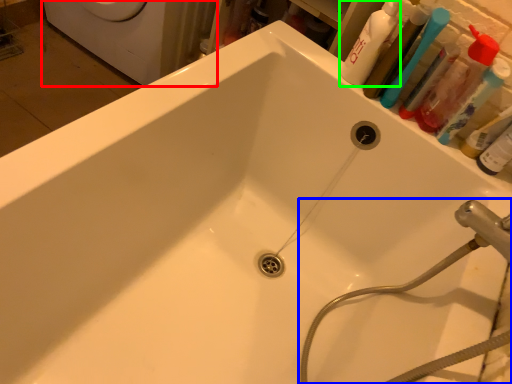
Question: Estimate the real-world distances between objects in this image. Which object is closer to washing machine (highlighted by a red box), plumbing fixture (highlighted by a blue box) or cleaning product (highlighted by a green box)?

Choices:
 (A) plumbing fixture
 (B) cleaning product

Answer: (B)